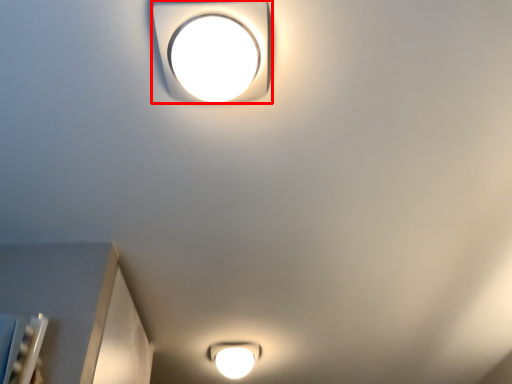
Question: From the image's perspective, where is lamp (annotated by the red box) located in relation to lamp in the image?

Choices:
 (A) above
 (B) below

Answer: (A)